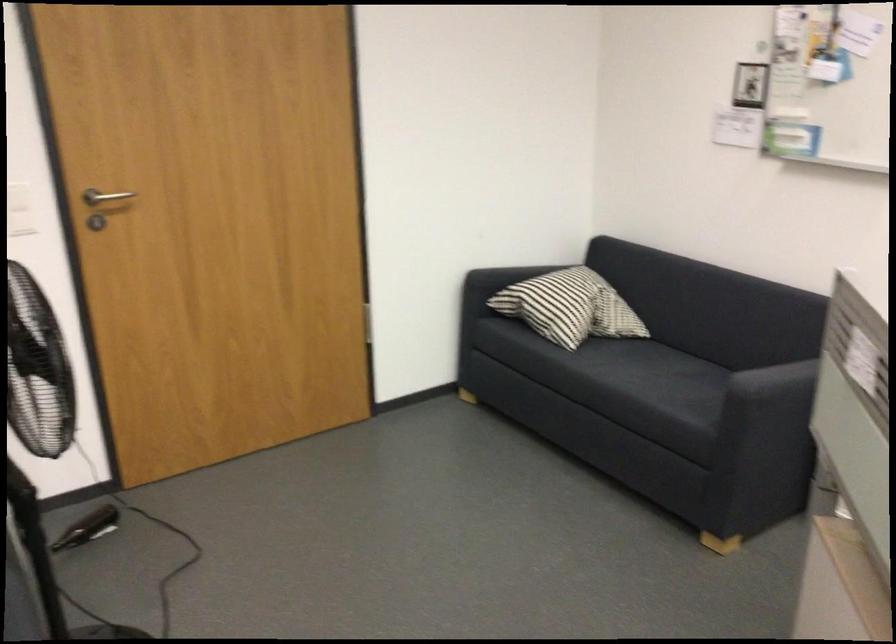
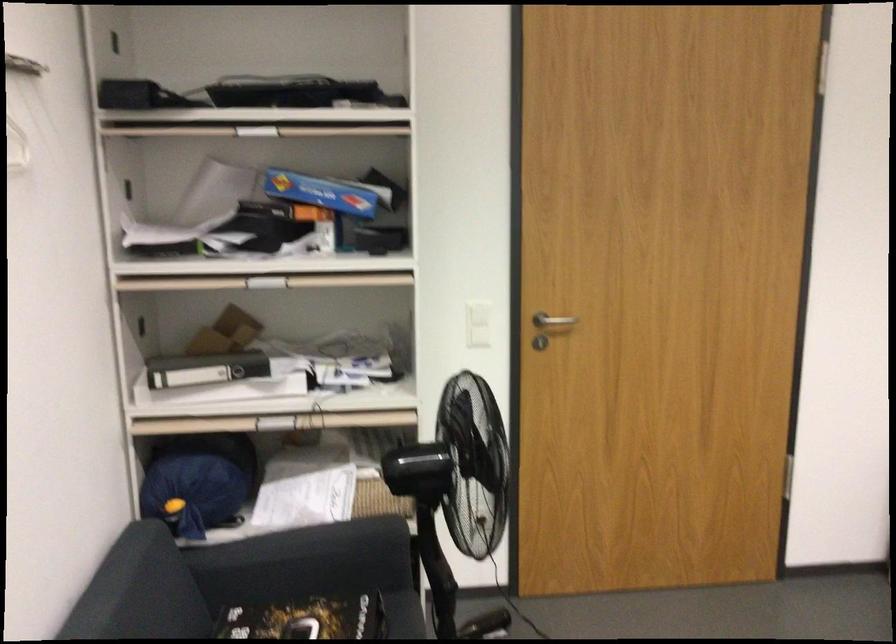
Question: How did the camera likely rotate?

Choices:
 (A) Left
 (B) Right
 (C) Up
 (D) Down

Answer: (A)